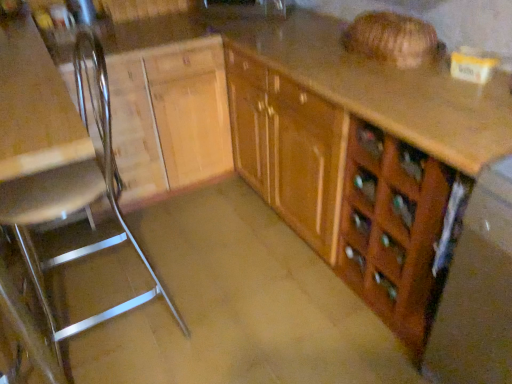
Question: Is the surface of metallic silver chair at left in direct contact with wooden cabinet at center?

Choices:
 (A) yes
 (B) no

Answer: (B)

Question: Would you say metallic silver chair at left is a long distance from wooden cabinet at center?

Choices:
 (A) no
 (B) yes

Answer: (A)

Question: Does metallic silver chair at left appear on the right side of wooden cabinet at center?

Choices:
 (A) yes
 (B) no

Answer: (B)

Question: Is wooden cabinet at center located within metallic silver chair at left?

Choices:
 (A) no
 (B) yes

Answer: (A)

Question: Does metallic silver chair at left have a larger size compared to wooden cabinet at center?

Choices:
 (A) no
 (B) yes

Answer: (A)

Question: Does point (37, 117) appear closer or farther from the camera than point (340, 130)?

Choices:
 (A) farther
 (B) closer

Answer: (B)

Question: In the image, is metallic silver chair at left on the left side or the right side of wooden cabinet at center?

Choices:
 (A) right
 (B) left

Answer: (B)

Question: From the image's perspective, is metallic silver chair at left positioned above or below wooden cabinet at center?

Choices:
 (A) above
 (B) below

Answer: (B)

Question: Looking at the image, does metallic silver chair at left seem bigger or smaller compared to wooden cabinet at center?

Choices:
 (A) small
 (B) big

Answer: (A)

Question: From a real-world perspective, is wooden drawer at lower right physically located above or below matte black sink at upper center?

Choices:
 (A) above
 (B) below

Answer: (B)

Question: Is wooden drawer at lower right to the left or to the right of matte black sink at upper center in the image?

Choices:
 (A) right
 (B) left

Answer: (A)

Question: In terms of height, does wooden drawer at lower right look taller or shorter compared to matte black sink at upper center?

Choices:
 (A) tall
 (B) short

Answer: (A)

Question: From the image's perspective, relative to matte black sink at upper center, is wooden drawer at lower right above or below?

Choices:
 (A) above
 (B) below

Answer: (B)

Question: From a real-world perspective, relative to brown matte concrete at center, is wooden cabinet at center vertically above or below?

Choices:
 (A) below
 (B) above

Answer: (B)

Question: In terms of height, does wooden cabinet at center look taller or shorter compared to brown matte concrete at center?

Choices:
 (A) short
 (B) tall

Answer: (B)